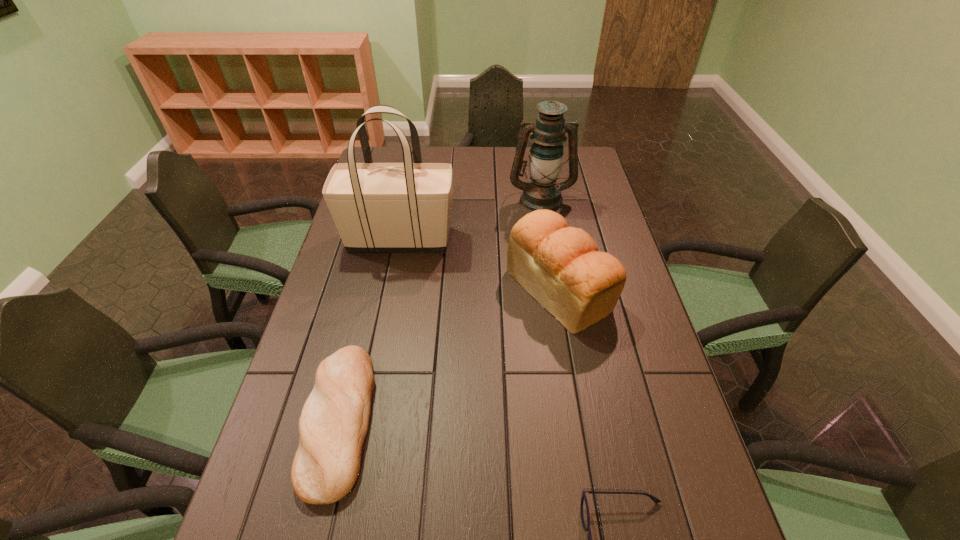
Locate an element on the screen. The width and height of the screenshot is (960, 540). object that ranks as the closest to the shorter bread is located at coordinates (560, 266).

Identify the location of vacant region that satisfies the following two spatial constraints: 1. on the back side of the fourth tallest object; 2. on the right side of the farthest object. (393, 199).

Where is `free region that satisfies the following two spatial constraints: 1. on the back side of the right bread; 2. with handles facing forward on the shopping bag`? free region that satisfies the following two spatial constraints: 1. on the back side of the right bread; 2. with handles facing forward on the shopping bag is located at coordinates (550, 239).